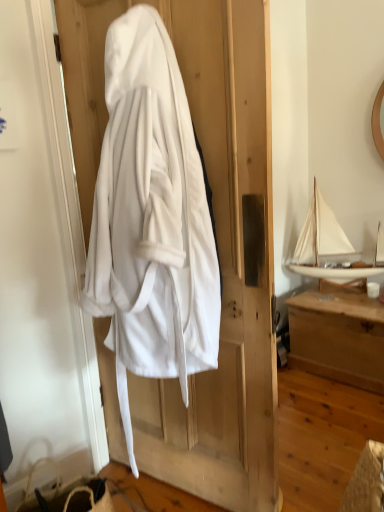
Question: Considering the positions of white soft robe at center and white wooden boat at upper right in the image, is white soft robe at center taller or shorter than white wooden boat at upper right?

Choices:
 (A) short
 (B) tall

Answer: (B)

Question: Is point (193, 475) positioned closer to the camera than point (304, 269)?

Choices:
 (A) farther
 (B) closer

Answer: (B)

Question: Estimate the real-world distances between objects in this image. Which object is farther from the white soft robe at center?

Choices:
 (A) wooden chest at right
 (B) white fabric screen door at left
 (C) white wooden boat at upper right

Answer: (C)

Question: Which object is positioned closest to the white fabric screen door at left?

Choices:
 (A) white wooden boat at upper right
 (B) white soft robe at center
 (C) wooden chest at right

Answer: (B)